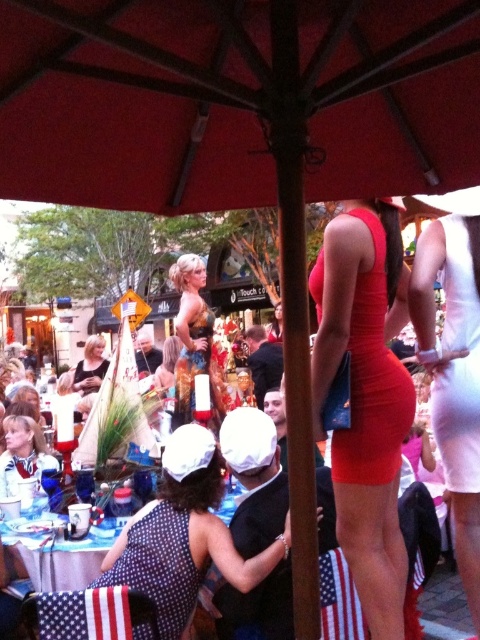
You are a photographer at the event and want to capture a photo of both the gold sequined dress at center and the blonde hair at center. Which one should you focus on first if you want to include both in your shot without moving the camera?

The gold sequined dress at center is to the right of blonde hair at center, so you should focus on the blonde hair at center first to ensure both are in frame without moving the camera.